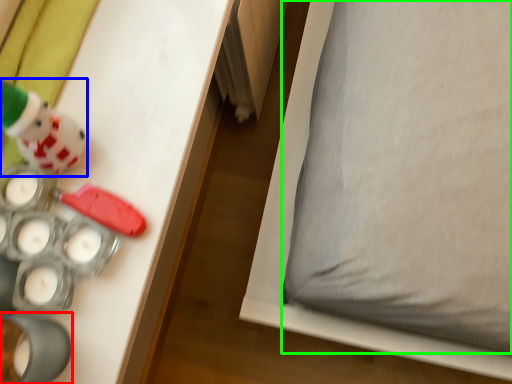
Question: Based on their relative distances, which object is nearer to toy (highlighted by a red box)? Choose from toy (highlighted by a blue box) and pillow (highlighted by a green box).

Choices:
 (A) toy
 (B) pillow

Answer: (A)